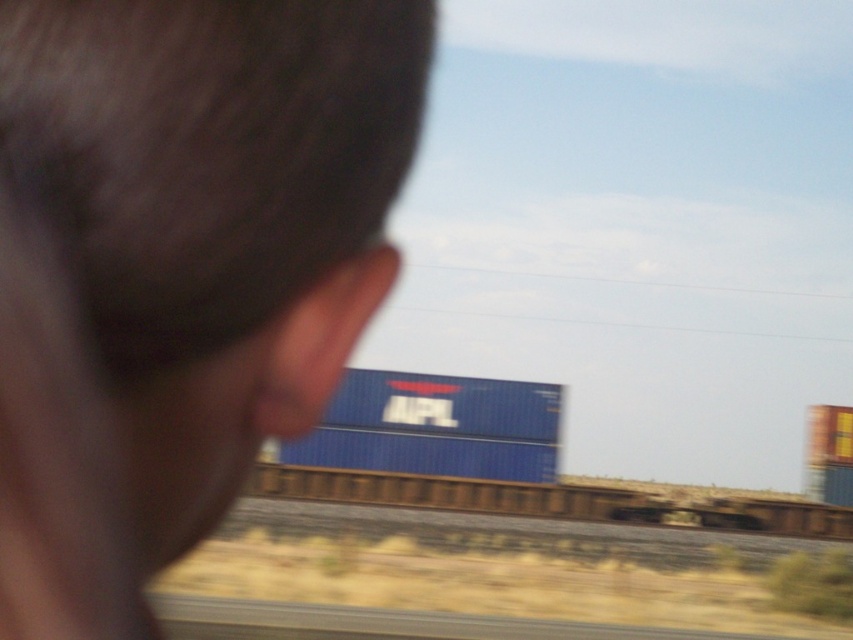
Question: Which point is farther from the camera taking this photo?

Choices:
 (A) tap(643, 516)
 (B) tap(517, 401)

Answer: (B)

Question: Is blue matte container at center positioned behind blue matte train car at center?

Choices:
 (A) no
 (B) yes

Answer: (A)

Question: Is blue matte container at center to the left of blue matte train car at center from the viewer's perspective?

Choices:
 (A) no
 (B) yes

Answer: (B)

Question: Which point appears closest to the camera in this image?

Choices:
 (A) (341, 420)
 (B) (843, 540)

Answer: (B)

Question: Observing the image, what is the correct spatial positioning of blue matte container at center in reference to blue matte train car at center?

Choices:
 (A) right
 (B) left

Answer: (B)

Question: Which object is farther from the camera taking this photo?

Choices:
 (A) blue matte container at center
 (B) blue matte train car at center

Answer: (B)